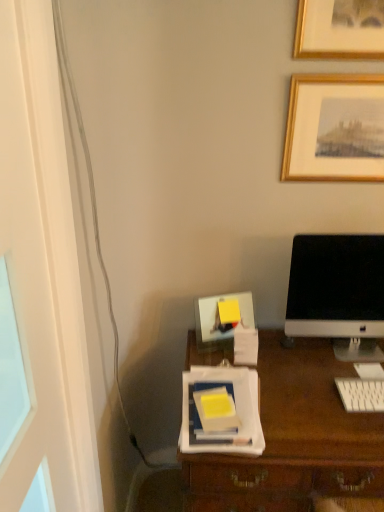
Question: Can you confirm if white glossy computer monitor at right is shorter than yellow matte notebook at center?

Choices:
 (A) no
 (B) yes

Answer: (A)

Question: Can you confirm if white glossy computer monitor at right is wider than yellow matte notebook at center?

Choices:
 (A) yes
 (B) no

Answer: (B)

Question: Is white glossy computer monitor at right closer to camera compared to yellow matte notebook at center?

Choices:
 (A) yes
 (B) no

Answer: (B)

Question: Considering the relative sizes of white glossy computer monitor at right and yellow matte notebook at center in the image provided, is white glossy computer monitor at right taller than yellow matte notebook at center?

Choices:
 (A) no
 (B) yes

Answer: (B)

Question: Does white glossy computer monitor at right have a lesser width compared to yellow matte notebook at center?

Choices:
 (A) yes
 (B) no

Answer: (A)

Question: Would you say white plastic keyboard at lower right is to the left or to the right of white glossy computer monitor at right in the picture?

Choices:
 (A) left
 (B) right

Answer: (B)

Question: From a real-world perspective, is white plastic keyboard at lower right physically located above or below white glossy computer monitor at right?

Choices:
 (A) below
 (B) above

Answer: (A)

Question: Would you say white plastic keyboard at lower right is inside or outside white glossy computer monitor at right?

Choices:
 (A) outside
 (B) inside

Answer: (A)

Question: Considering their positions, is white plastic keyboard at lower right located in front of or behind white glossy computer monitor at right?

Choices:
 (A) behind
 (B) front

Answer: (B)

Question: From the image's perspective, is yellow matte notebook at center located above or below white plastic keyboard at lower right?

Choices:
 (A) below
 (B) above

Answer: (B)

Question: Is point (228, 399) positioned closer to the camera than point (377, 379)?

Choices:
 (A) farther
 (B) closer

Answer: (B)

Question: Relative to white plastic keyboard at lower right, is yellow matte notebook at center in front or behind?

Choices:
 (A) front
 (B) behind

Answer: (A)

Question: Is yellow matte notebook at center situated inside white plastic keyboard at lower right or outside?

Choices:
 (A) outside
 (B) inside

Answer: (A)

Question: Considering the positions of white glossy computer monitor at right and gold wooden picture frame at upper right in the image, is white glossy computer monitor at right bigger or smaller than gold wooden picture frame at upper right?

Choices:
 (A) small
 (B) big

Answer: (B)

Question: Would you say white glossy computer monitor at right is inside or outside gold wooden picture frame at upper right?

Choices:
 (A) inside
 (B) outside

Answer: (B)